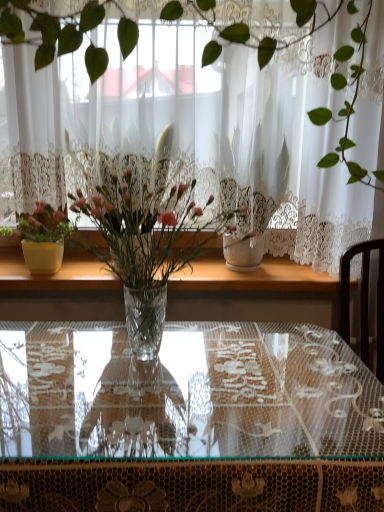
Question: Is matte yellow pot at left, which appears as the 2th houseplant when viewed from the right, outside clear glass vase at center, which is the 1th houseplant from right to left?

Choices:
 (A) yes
 (B) no

Answer: (A)

Question: Is matte yellow pot at left, marked as the 1th houseplant in a left-to-right arrangement, to the left of clear glass vase at center, which appears as the first houseplant when viewed from the front, from the viewer's perspective?

Choices:
 (A) yes
 (B) no

Answer: (A)

Question: From a real-world perspective, is matte yellow pot at left, which appears as the 2th houseplant when viewed from the right, beneath clear glass vase at center, which appears as the first houseplant when viewed from the front?

Choices:
 (A) yes
 (B) no

Answer: (A)

Question: Considering the relative sizes of matte yellow pot at left, the second houseplant positioned from the front, and clear glass vase at center, positioned as the 2th houseplant in left-to-right order, in the image provided, is matte yellow pot at left, the second houseplant positioned from the front, smaller than clear glass vase at center, positioned as the 2th houseplant in left-to-right order,?

Choices:
 (A) yes
 (B) no

Answer: (A)

Question: From the image's perspective, would you say matte yellow pot at left, which appears as the 2th houseplant when viewed from the right, is shown under clear glass vase at center, which appears as the first houseplant when viewed from the front?

Choices:
 (A) yes
 (B) no

Answer: (B)

Question: Is white lace curtain at center to the left or to the right of transparent glass table at center in the image?

Choices:
 (A) left
 (B) right

Answer: (B)

Question: From a real-world perspective, relative to transparent glass table at center, is white lace curtain at center vertically above or below?

Choices:
 (A) above
 (B) below

Answer: (A)

Question: Is white lace curtain at center in front of or behind transparent glass table at center in the image?

Choices:
 (A) front
 (B) behind

Answer: (B)

Question: Is white lace curtain at center wider or thinner than transparent glass table at center?

Choices:
 (A) wide
 (B) thin

Answer: (B)

Question: In terms of height, does matte yellow pot at left, marked as the 1th houseplant in a left-to-right arrangement, look taller or shorter compared to clear glass vase at center, which is the 1th houseplant from right to left?

Choices:
 (A) tall
 (B) short

Answer: (B)

Question: Is matte yellow pot at left, marked as the 1th houseplant in a left-to-right arrangement, wider or thinner than clear glass vase at center, which is the 2th houseplant in back-to-front order?

Choices:
 (A) wide
 (B) thin

Answer: (B)

Question: Considering the relative positions of matte yellow pot at left, marked as the 1th houseplant in a left-to-right arrangement, and clear glass vase at center, which is the 1th houseplant from right to left, in the image provided, is matte yellow pot at left, marked as the 1th houseplant in a left-to-right arrangement, to the left or to the right of clear glass vase at center, which is the 1th houseplant from right to left,?

Choices:
 (A) left
 (B) right

Answer: (A)

Question: Considering their positions, is matte yellow pot at left, the first houseplant from the back, located in front of or behind clear glass vase at center, which appears as the first houseplant when viewed from the front?

Choices:
 (A) behind
 (B) front

Answer: (A)

Question: Is transparent glass table at center inside the boundaries of clear glass vase at center, which appears as the first houseplant when viewed from the front, or outside?

Choices:
 (A) inside
 (B) outside

Answer: (B)

Question: Is transparent glass table at center bigger or smaller than clear glass vase at center, positioned as the 2th houseplant in left-to-right order?

Choices:
 (A) small
 (B) big

Answer: (B)